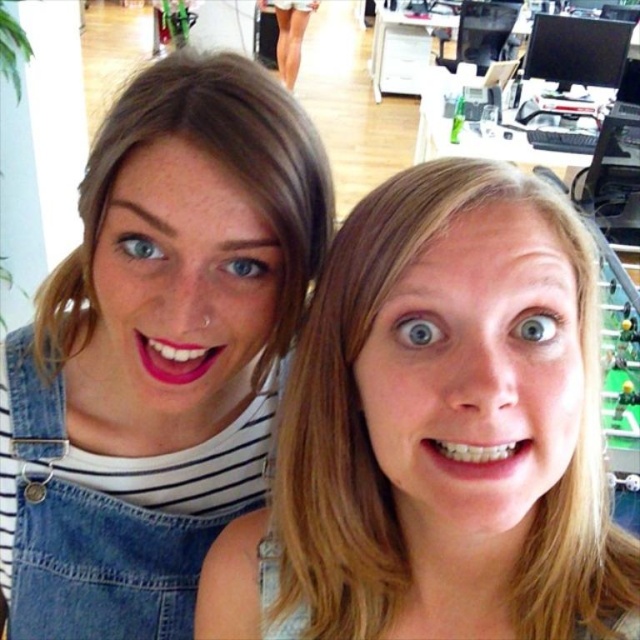
Looking at this image, is the position of denim overalls at left more distant than that of matte denim overalls at left?

Yes, denim overalls at left is behind matte denim overalls at left.

At what (x,y) coordinates should I click in order to perform the action: click on denim overalls at left. Please return your answer as a coordinate pair (x, y). The image size is (640, 640). Looking at the image, I should click on (104, 563).

The height and width of the screenshot is (640, 640). In order to click on denim overalls at left in this screenshot , I will do `click(104, 563)`.

Is point (493, 470) closer to camera compared to point (314, 198)?

Yes, point (493, 470) is closer to viewer.

Measure the distance between matte denim overalls at center and camera.

matte denim overalls at center is 13.58 inches from camera.

What do you see at coordinates (440, 429) in the screenshot? I see `matte denim overalls at center` at bounding box center [440, 429].

Locate an element on the screen. This screenshot has width=640, height=640. matte denim overalls at center is located at coordinates (440, 429).

Which of these two, matte denim overalls at center or denim overalls at left, stands shorter?

denim overalls at left

Can you confirm if matte denim overalls at center is positioned above denim overalls at left?

Indeed, matte denim overalls at center is positioned over denim overalls at left.

The height and width of the screenshot is (640, 640). I want to click on matte denim overalls at center, so click(440, 429).